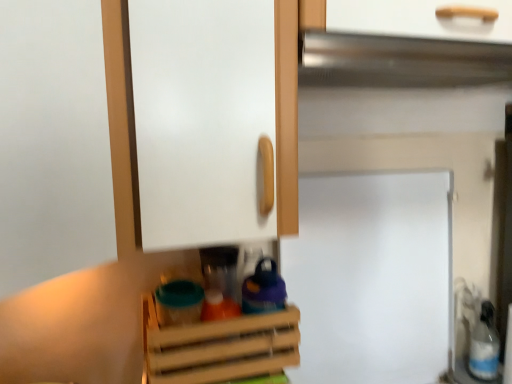
Question: In the image, is silver metallic exhaust hood at upper center positioned in front of or behind wooden crate at center?

Choices:
 (A) front
 (B) behind

Answer: (A)

Question: From a real-world perspective, is silver metallic exhaust hood at upper center above or below wooden crate at center?

Choices:
 (A) below
 (B) above

Answer: (B)

Question: Which object is positioned farthest from the white matte fridge at center?

Choices:
 (A) wooden crate at center
 (B) silver metallic exhaust hood at upper center
 (C) white plastic bottle at lower right

Answer: (B)

Question: Which of these objects is positioned closest to the wooden crate at center?

Choices:
 (A) white plastic bottle at lower right
 (B) white matte fridge at center
 (C) silver metallic exhaust hood at upper center

Answer: (B)